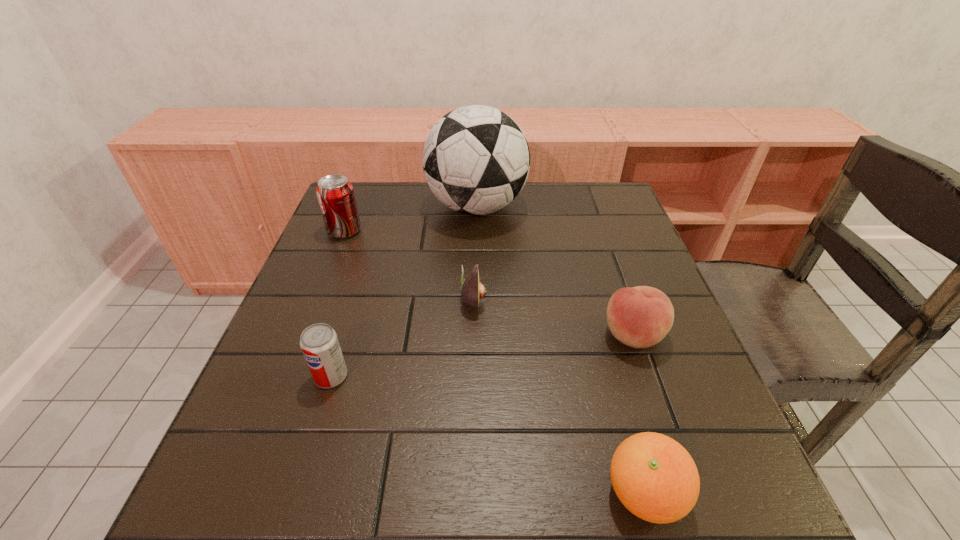
Identify the location of object situated at the near right corner. (655, 478).

In the image, there is a desktop. At what (x,y) coordinates should I click in order to perform the action: click on vacant space at the far edge. Please return your answer as a coordinate pair (x, y). The height and width of the screenshot is (540, 960). Looking at the image, I should click on (396, 212).

I want to click on vacant position at the near edge of the desktop, so click(x=572, y=494).

The image size is (960, 540). In the image, there is a desktop. Find the location of `vacant space at the left edge`. vacant space at the left edge is located at coordinates (241, 411).

Locate an element on the screen. blank space at the right edge of the desktop is located at coordinates (671, 361).

I want to click on free space at the far left corner, so click(392, 206).

This screenshot has width=960, height=540. Find the location of `free space at the far right corner of the desktop`. free space at the far right corner of the desktop is located at coordinates (617, 186).

Identify the location of free point between the avocado and the orange. (559, 397).

Locate an element on the screen. The image size is (960, 540). vacant space that's between the orange and the soccer ball is located at coordinates (561, 350).

Image resolution: width=960 pixels, height=540 pixels. I want to click on empty space that is in between the shorter soda and the peach, so click(x=482, y=356).